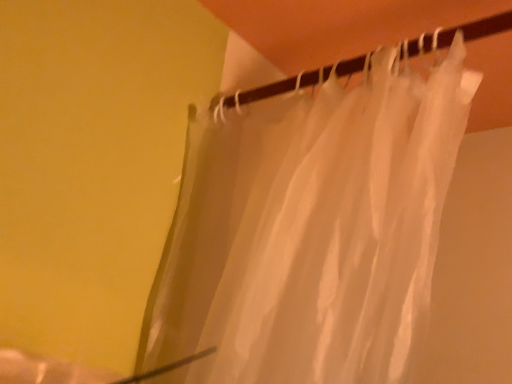
Question: Considering the relative positions of translucent white curtain at upper center and translucent fabric at upper center in the image provided, is translucent white curtain at upper center to the left of translucent fabric at upper center from the viewer's perspective?

Choices:
 (A) no
 (B) yes

Answer: (A)

Question: Can translucent fabric at upper center be found inside translucent white curtain at upper center?

Choices:
 (A) yes
 (B) no

Answer: (A)

Question: From the image's perspective, is translucent white curtain at upper center below translucent fabric at upper center?

Choices:
 (A) no
 (B) yes

Answer: (B)

Question: Would you consider translucent white curtain at upper center to be distant from translucent fabric at upper center?

Choices:
 (A) yes
 (B) no

Answer: (B)

Question: From the image's perspective, is translucent white curtain at upper center on top of translucent fabric at upper center?

Choices:
 (A) no
 (B) yes

Answer: (A)

Question: Does translucent white curtain at upper center turn towards translucent fabric at upper center?

Choices:
 (A) no
 (B) yes

Answer: (A)

Question: From the image's perspective, is translucent fabric at upper center over translucent white curtain at upper center?

Choices:
 (A) no
 (B) yes

Answer: (B)

Question: From the image's perspective, does translucent fabric at upper center appear lower than translucent white curtain at upper center?

Choices:
 (A) yes
 (B) no

Answer: (B)

Question: Is translucent fabric at upper center to the left of translucent white curtain at upper center from the viewer's perspective?

Choices:
 (A) yes
 (B) no

Answer: (A)

Question: Is translucent fabric at upper center bigger than translucent white curtain at upper center?

Choices:
 (A) yes
 (B) no

Answer: (B)

Question: Is translucent fabric at upper center closer to camera compared to translucent white curtain at upper center?

Choices:
 (A) yes
 (B) no

Answer: (B)

Question: Is translucent fabric at upper center to the right of translucent white curtain at upper center from the viewer's perspective?

Choices:
 (A) no
 (B) yes

Answer: (A)

Question: Would you say translucent fabric at upper center is to the left or to the right of translucent white curtain at upper center in the picture?

Choices:
 (A) right
 (B) left

Answer: (B)